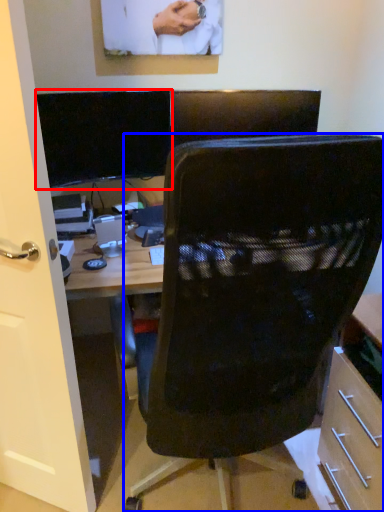
Question: Which object appears farthest to the camera in this image, computer monitor (highlighted by a red box) or chair (highlighted by a blue box)?

Choices:
 (A) computer monitor
 (B) chair

Answer: (A)